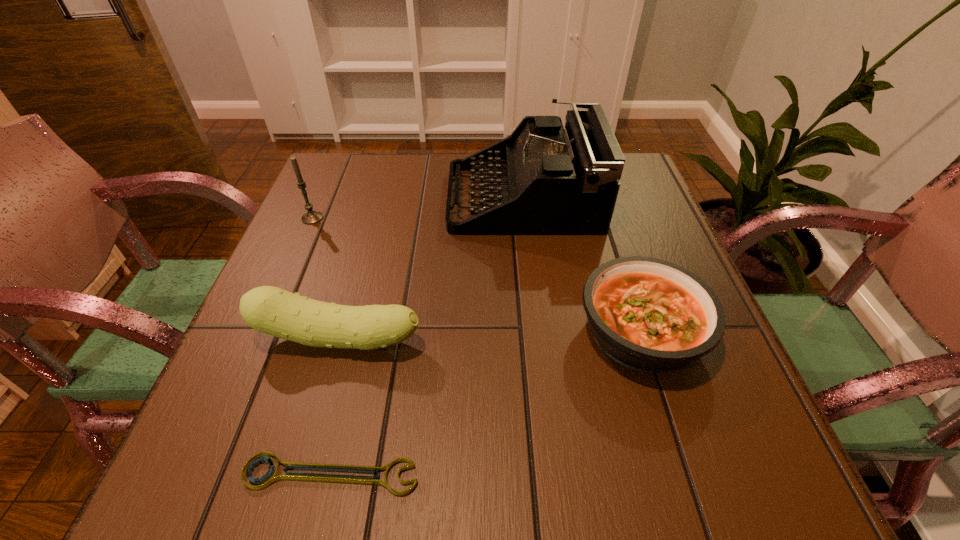
You are a GUI agent. You are given a task and a screenshot of the screen. Output one action in this format:
    pyautogui.click(x=<x>, y=<y>)
    Task: Click on the free space located 0.080m on the right of the cucumber
    This screenshot has height=540, width=960.
    Given the screenshot: What is the action you would take?
    pyautogui.click(x=468, y=339)

Identify the location of vacant region located 0.130m on the left of the fourth tallest object. (505, 332).

I want to click on free space located on the right of the shortest object, so click(x=566, y=475).

At what (x,y) coordinates should I click in order to perform the action: click on object that is positioned at the far edge. Please return your answer as a coordinate pair (x, y). Image resolution: width=960 pixels, height=540 pixels. Looking at the image, I should click on pyautogui.click(x=549, y=180).

At what (x,y) coordinates should I click in order to perform the action: click on object located in the near edge section of the desktop. Please return your answer as a coordinate pair (x, y). Looking at the image, I should click on (270, 477).

What are the coordinates of `candle situated at the left edge` in the screenshot? It's located at (311, 217).

This screenshot has width=960, height=540. I want to click on cucumber that is positioned at the left edge, so click(x=271, y=310).

Locate an element on the screen. This screenshot has width=960, height=540. wrench located at the left edge is located at coordinates (270, 477).

Identify the location of typewriter that is at the right edge. The width and height of the screenshot is (960, 540). (549, 180).

Identify the location of stew present at the right edge. This screenshot has height=540, width=960. (650, 315).